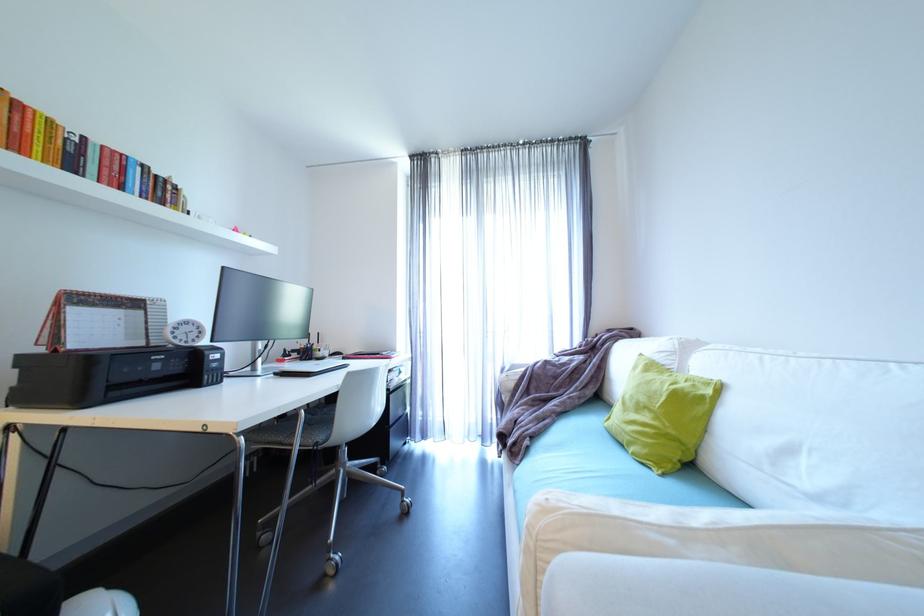
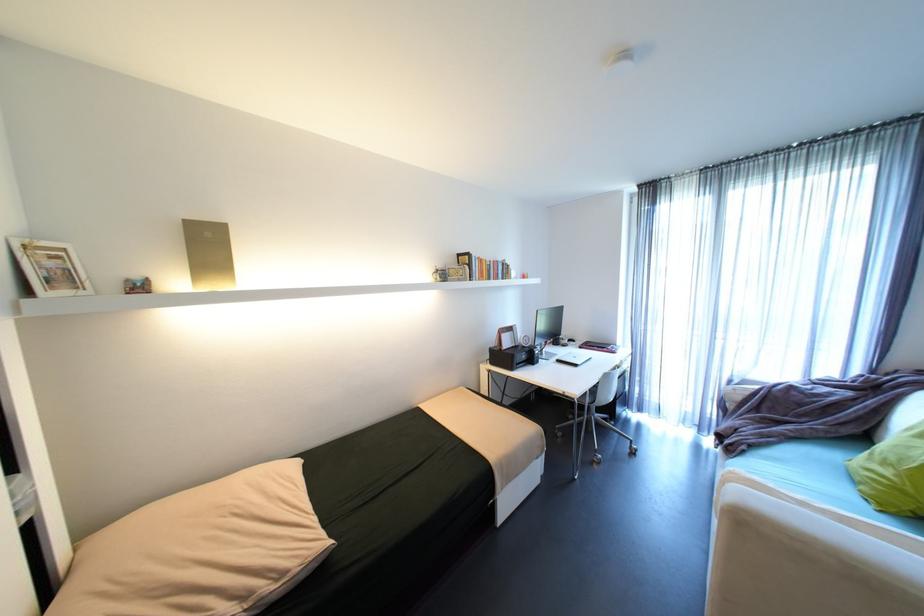
The point at (x=231, y=267) is marked in the first image. Where is the corresponding point in the second image?

(544, 310)